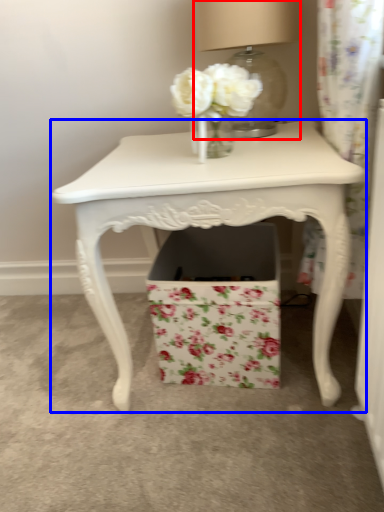
Question: Which object appears farthest to the camera in this image, table lamp (highlighted by a red box) or table (highlighted by a blue box)?

Choices:
 (A) table lamp
 (B) table

Answer: (A)